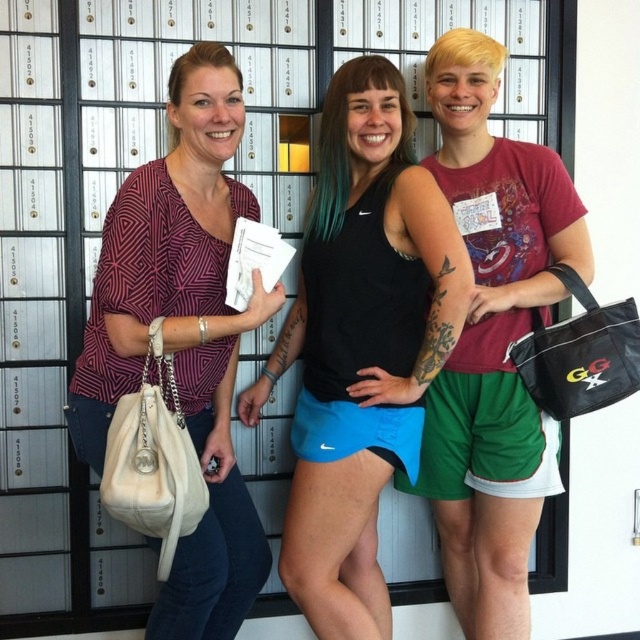
Question: Is matte red shorts at center positioned before matte black purse at left?

Choices:
 (A) yes
 (B) no

Answer: (B)

Question: Is matte red shorts at center above matte black purse at left?

Choices:
 (A) no
 (B) yes

Answer: (A)

Question: Is black matte tank top at center positioned before matte red shorts at center?

Choices:
 (A) no
 (B) yes

Answer: (B)

Question: Which of the following is the closest to the observer?

Choices:
 (A) (221, 241)
 (B) (349, 344)

Answer: (B)

Question: Considering the real-world distances, which object is farthest from the matte black purse at left?

Choices:
 (A) black matte tank top at center
 (B) matte red shorts at center

Answer: (B)

Question: Which point appears farthest from the camera in this image?

Choices:
 (A) (529, 316)
 (B) (212, 308)
 (C) (385, 163)

Answer: (A)